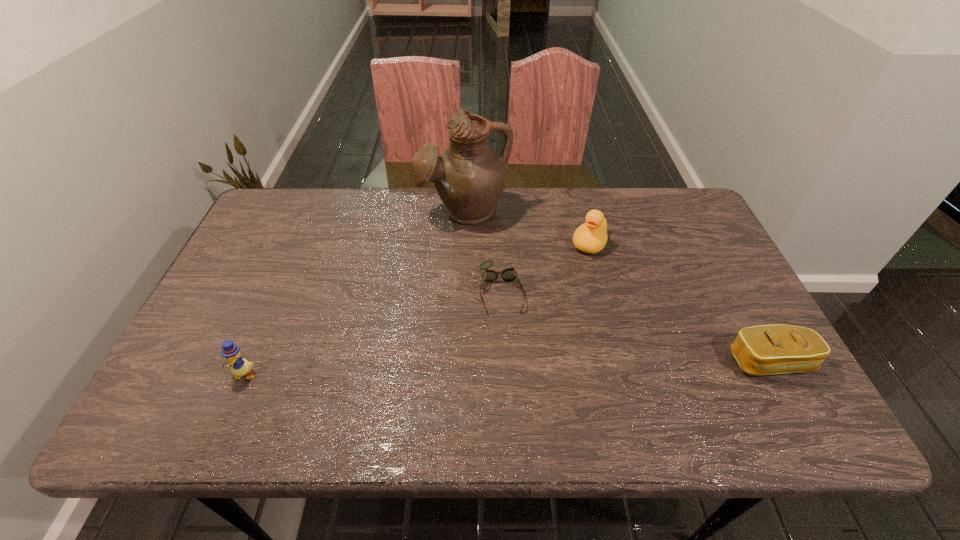
At what (x,y) coordinates should I click in order to perform the action: click on blank space located 0.280m on the face of the fourth object from left to right. Please return your answer as a coordinate pair (x, y). The image size is (960, 540). Looking at the image, I should click on (550, 326).

Where is `free space located on the face of the fourth object from left to right`? Image resolution: width=960 pixels, height=540 pixels. free space located on the face of the fourth object from left to right is located at coordinates (561, 304).

The image size is (960, 540). Identify the location of vacant region located on the face of the fourth object from left to right. (544, 338).

You are a GUI agent. You are given a task and a screenshot of the screen. Output one action in this format:
    pyautogui.click(x=<x>, y=<y>)
    Task: Click on the vacant space situated 0.180m on the front-facing side of the third nearest object
    
    Given the screenshot: What is the action you would take?
    pyautogui.click(x=514, y=379)

The width and height of the screenshot is (960, 540). Identify the location of free region located 0.180m on the front-facing side of the third nearest object. (514, 379).

Locate an element on the screen. The width and height of the screenshot is (960, 540). vacant position located 0.090m on the front-facing side of the third nearest object is located at coordinates (509, 346).

Locate an element on the screen. The image size is (960, 540). pitcher located in the far edge section of the desktop is located at coordinates (469, 177).

Find the location of `duck that is at the far edge`. duck that is at the far edge is located at coordinates (591, 237).

The image size is (960, 540). Find the location of `duckling at the near edge`. duckling at the near edge is located at coordinates (240, 367).

Identify the location of clutch bag that is at the near edge. The height and width of the screenshot is (540, 960). (767, 349).